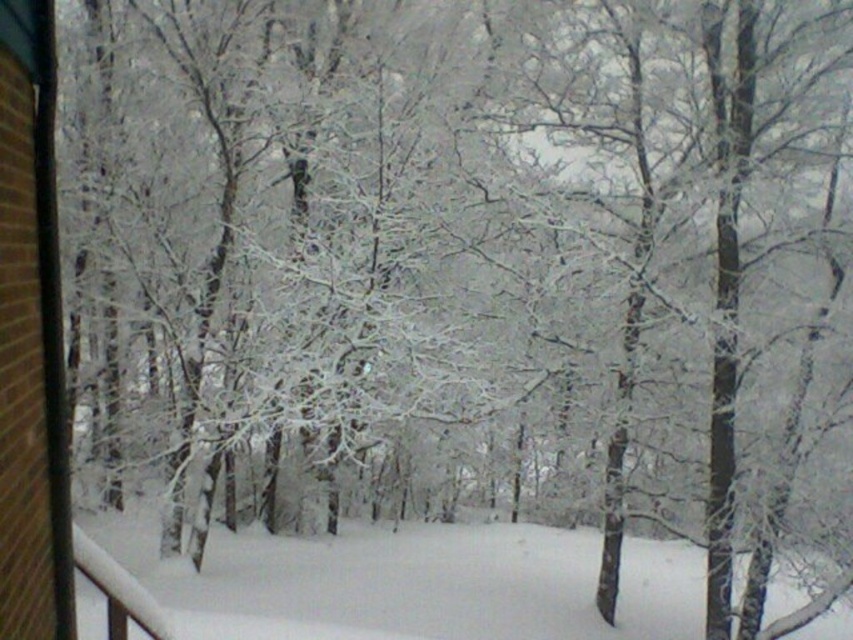
Question: Which point is closer to the camera taking this photo?

Choices:
 (A) (103, 532)
 (B) (49, 387)

Answer: (B)

Question: Does white fluffy snow at center come behind brown brick window at left?

Choices:
 (A) no
 (B) yes

Answer: (B)

Question: Is the position of white fluffy snow at center less distant than that of brown brick window at left?

Choices:
 (A) yes
 (B) no

Answer: (B)

Question: Can you confirm if white fluffy snow at center is smaller than brown brick window at left?

Choices:
 (A) yes
 (B) no

Answer: (B)

Question: Which point appears closest to the camera in this image?

Choices:
 (A) (32, 332)
 (B) (500, 531)

Answer: (A)